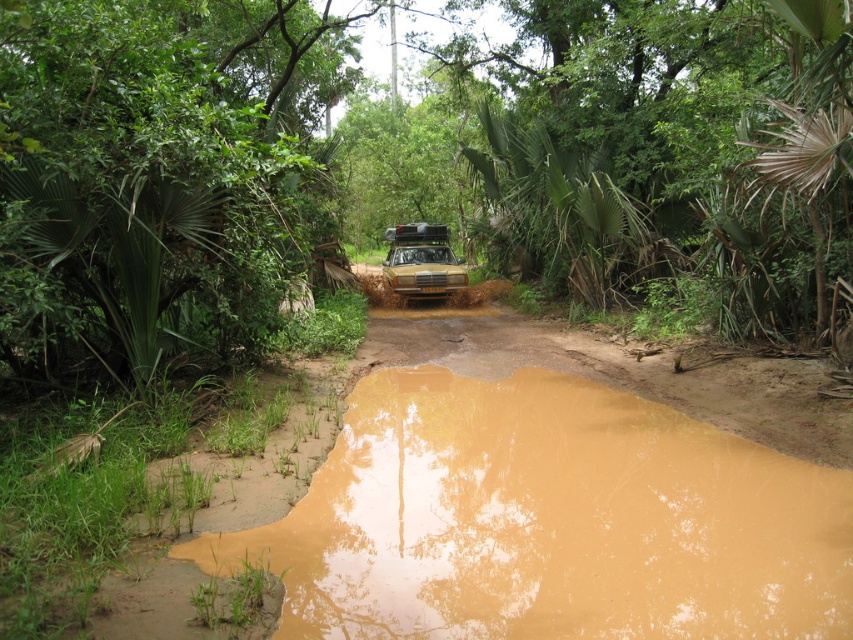
You are a driver approaching the yellow matte car at center on the rugged road. The road has brown muddy water at lower center. Can you safely pass the car without getting your vehicle stuck in the mud?

The brown muddy water at lower center is wider than the yellow matte car at center, so there might not be enough space to safely pass the car without risking getting stuck in the mud. Proceed with caution or consider an alternative route.

You are standing at the point labeled as point (549, 522) in the image. What is the terrain like at that location?

The terrain at point (549, 522) is brown muddy water at lower center.